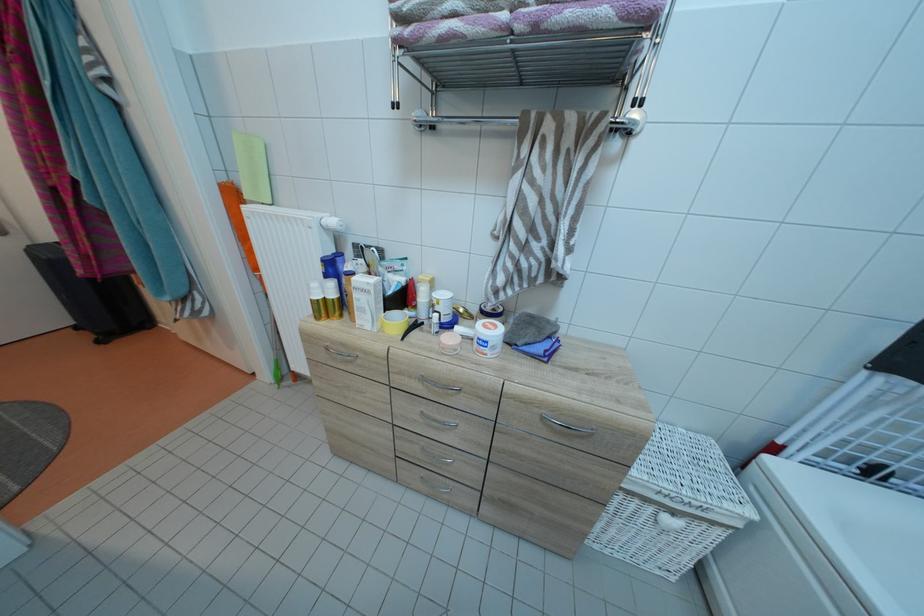
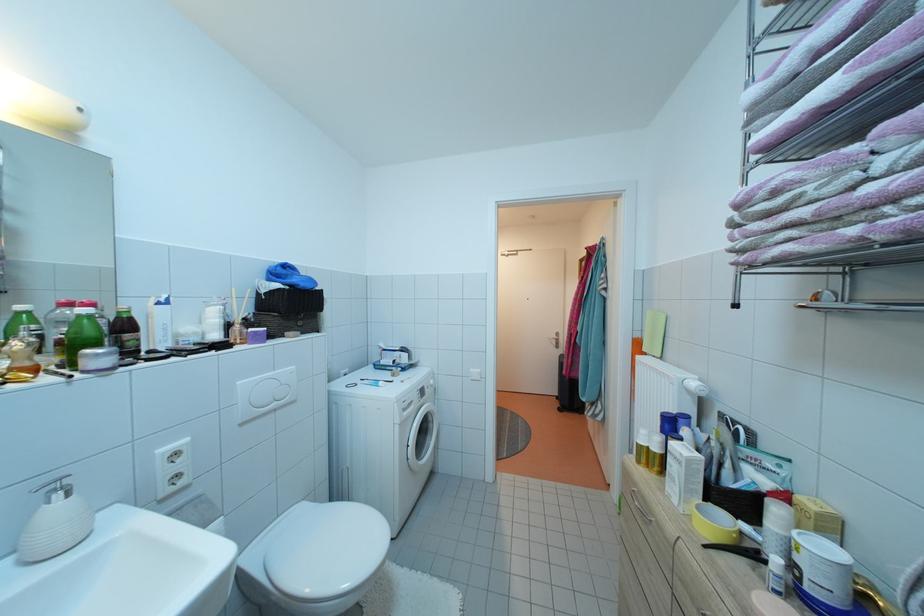
Where in the second image is the point corresponding to point 388,334 from the first image?

(697, 523)